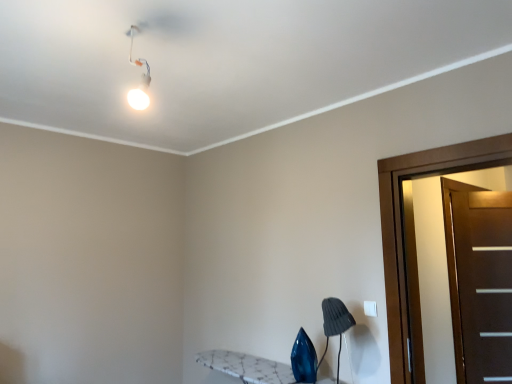
Question: Considering the relative sizes of dark brown wood door at right, the 1th door positioned from the left, and blue glass swivel chair at lower right in the image provided, is dark brown wood door at right, the 1th door positioned from the left, wider than blue glass swivel chair at lower right?

Choices:
 (A) yes
 (B) no

Answer: (A)

Question: Can you confirm if dark brown wood door at right, the second door in the right-to-left sequence, is taller than blue glass swivel chair at lower right?

Choices:
 (A) yes
 (B) no

Answer: (A)

Question: Is dark brown wood door at right, the second door when ordered from back to front, closer to the viewer compared to blue glass swivel chair at lower right?

Choices:
 (A) yes
 (B) no

Answer: (A)

Question: From the image's perspective, is dark brown wood door at right, the second door in the right-to-left sequence, beneath blue glass swivel chair at lower right?

Choices:
 (A) no
 (B) yes

Answer: (A)

Question: Is dark brown wood door at right, the 1th door positioned from the left, directly adjacent to blue glass swivel chair at lower right?

Choices:
 (A) no
 (B) yes

Answer: (A)

Question: Is the depth of dark brown wood door at right, the 1th door when ordered from front to back, greater than that of blue glass swivel chair at lower right?

Choices:
 (A) yes
 (B) no

Answer: (B)

Question: Is brown matte door at right, the 1th door viewed from the back, with white glossy light fixture at upper left?

Choices:
 (A) no
 (B) yes

Answer: (A)

Question: From a real-world perspective, is brown matte door at right, the 1th door viewed from the back, positioned over white glossy light fixture at upper left based on gravity?

Choices:
 (A) no
 (B) yes

Answer: (A)

Question: Considering the relative sizes of brown matte door at right, positioned as the second door in front-to-back order, and white glossy light fixture at upper left in the image provided, is brown matte door at right, positioned as the second door in front-to-back order, bigger than white glossy light fixture at upper left?

Choices:
 (A) yes
 (B) no

Answer: (A)

Question: Is brown matte door at right, positioned as the 2th door in left-to-right order, not close to white glossy light fixture at upper left?

Choices:
 (A) no
 (B) yes

Answer: (B)

Question: From a real-world perspective, is brown matte door at right, positioned as the 2th door in left-to-right order, beneath white glossy light fixture at upper left?

Choices:
 (A) no
 (B) yes

Answer: (B)

Question: Does brown matte door at right, which is the 1th door from right to left, have a lesser height compared to white glossy light fixture at upper left?

Choices:
 (A) no
 (B) yes

Answer: (A)

Question: From a real-world perspective, is white glossy light fixture at upper left below gray fabric lampshade at lower right?

Choices:
 (A) no
 (B) yes

Answer: (A)